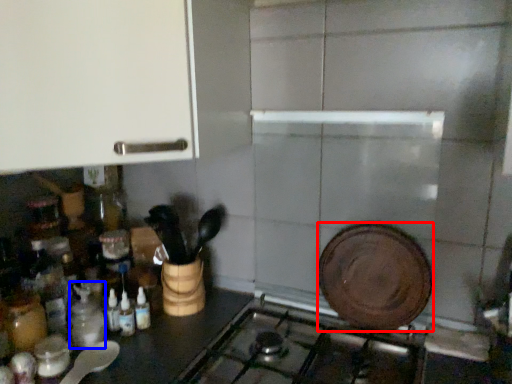
Question: Which of the following is the closest to the observer, kitchen appliance (highlighted by a red box) or bottle (highlighted by a blue box)?

Choices:
 (A) kitchen appliance
 (B) bottle

Answer: (A)